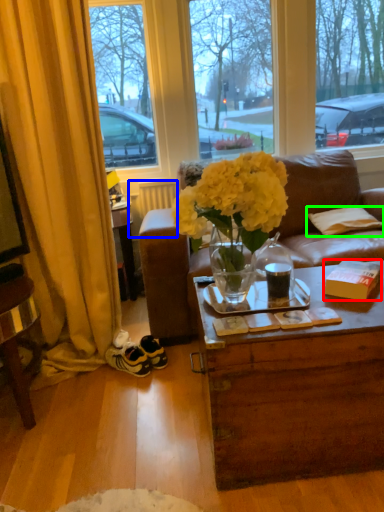
Question: Considering the real-world distances, which object is closest to box (highlighted by a red box)? radiator (highlighted by a blue box) or pillow (highlighted by a green box).

Choices:
 (A) radiator
 (B) pillow

Answer: (B)